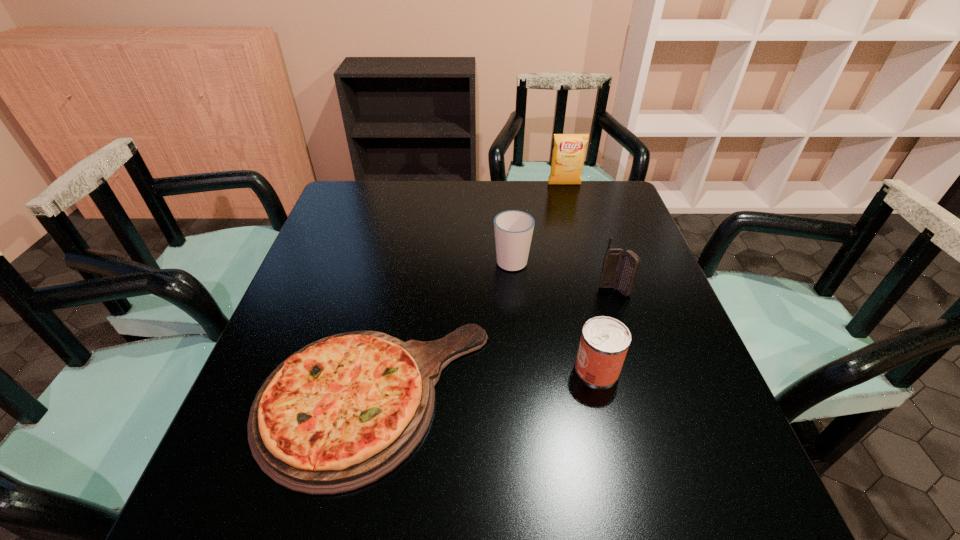
The height and width of the screenshot is (540, 960). What are the coordinates of `vacant area that lies between the farthest object and the third nearest object` in the screenshot? It's located at (589, 238).

Identify the location of free space between the farthest object and the third nearest object. pyautogui.click(x=589, y=238).

This screenshot has height=540, width=960. I want to click on free space between the cup and the leftmost object, so click(x=443, y=329).

Identify the location of free space between the farthest object and the cellular telephone. The width and height of the screenshot is (960, 540). (589, 238).

Find the location of a particular element. empty space between the fourth tallest object and the leftmost object is located at coordinates (486, 383).

What are the coordinates of `blank region between the third nearest object and the farthest object` in the screenshot? It's located at (589, 238).

At what (x,y) coordinates should I click in order to perform the action: click on free space that is in between the cup and the shortest object. Please return your answer as a coordinate pair (x, y). This screenshot has width=960, height=540. Looking at the image, I should click on (443, 329).

The image size is (960, 540). In order to click on the fourth closest object to the crisp (potato chip) in this screenshot , I will do `click(604, 343)`.

Image resolution: width=960 pixels, height=540 pixels. Identify the location of object that is the second nearest to the cup. (341, 413).